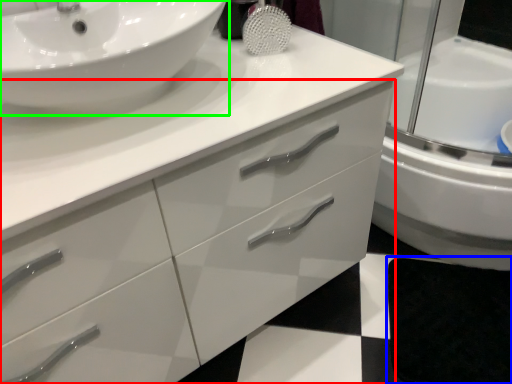
Question: Which object is positioned farthest from bathroom cabinet (highlighted by a red box)? Select from bath mat (highlighted by a blue box) and sink (highlighted by a green box).

Choices:
 (A) bath mat
 (B) sink

Answer: (A)